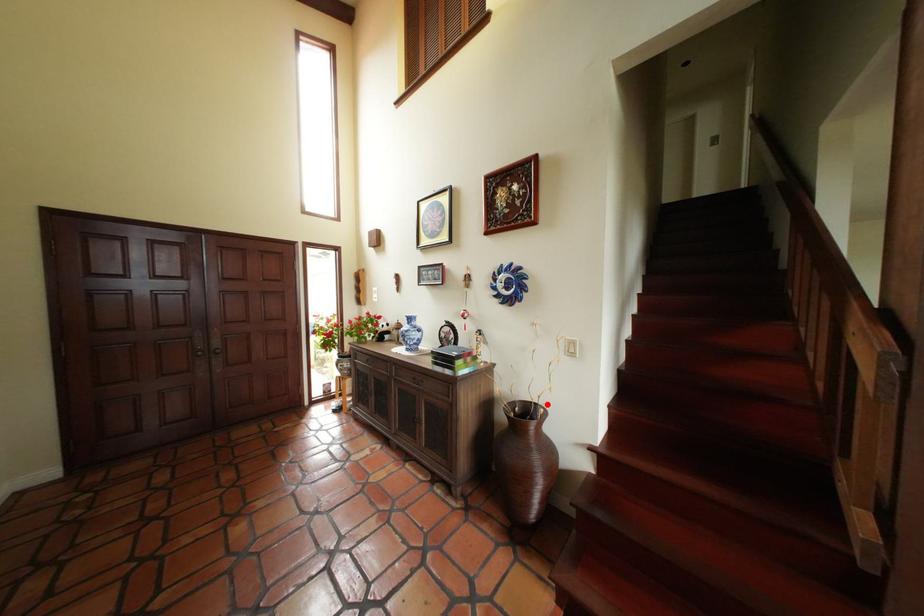
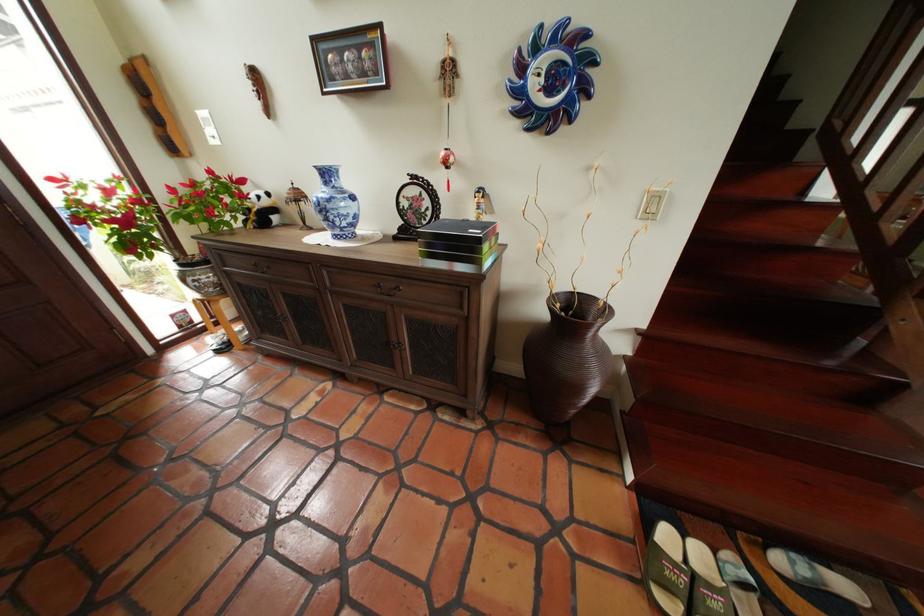
Question: I am providing you with two images of the same scene from different viewpoints. A red point is shown in image1. For the corresponding object point in image2, is it positioned nearer or farther from the camera?

Choices:
 (A) Nearer
 (B) Farther

Answer: (A)